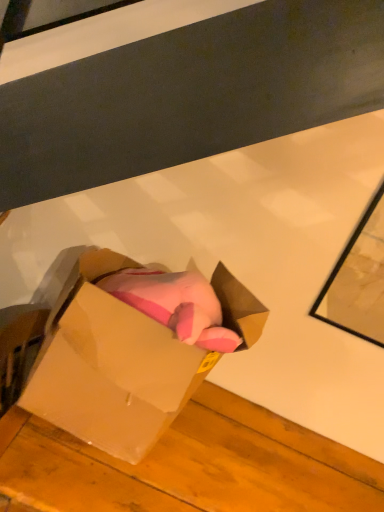
Where is `matte cardboard box at center`? matte cardboard box at center is located at coordinates (110, 366).

What do you see at coordinates (110, 366) in the screenshot? I see `matte cardboard box at center` at bounding box center [110, 366].

What is the approximate height of matte cardboard box at center?

24.58 inches.

Locate an element on the screen. The height and width of the screenshot is (512, 384). matte cardboard box at center is located at coordinates (110, 366).